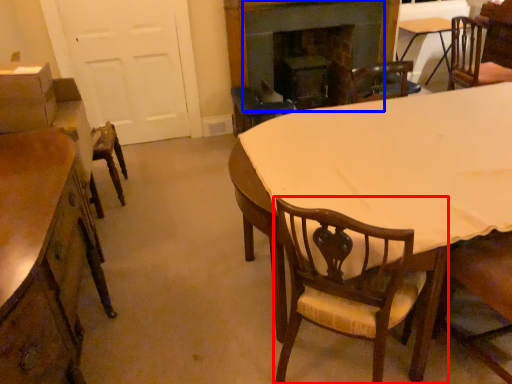
Question: Among these objects, which one is farthest to the camera, chair (highlighted by a red box) or fireplace (highlighted by a blue box)?

Choices:
 (A) chair
 (B) fireplace

Answer: (B)